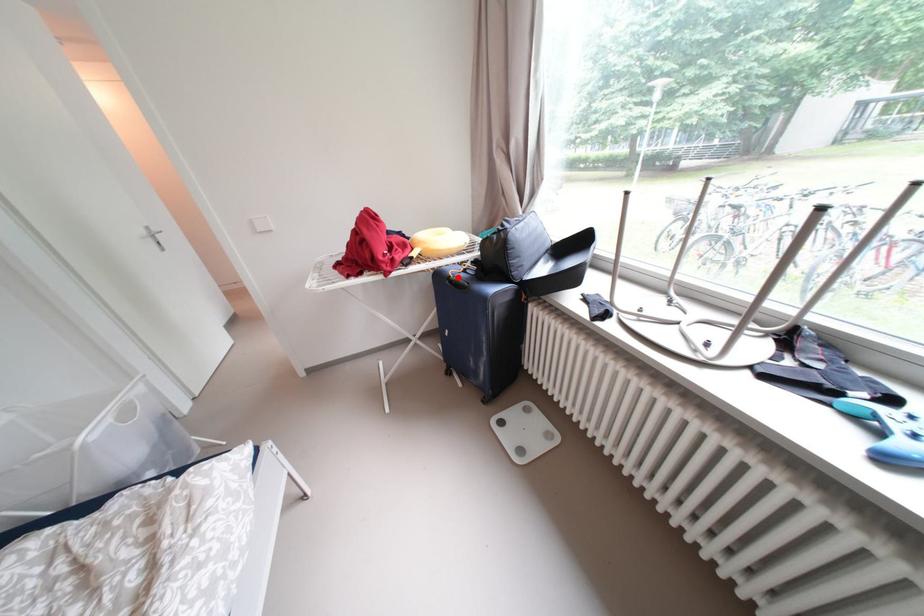
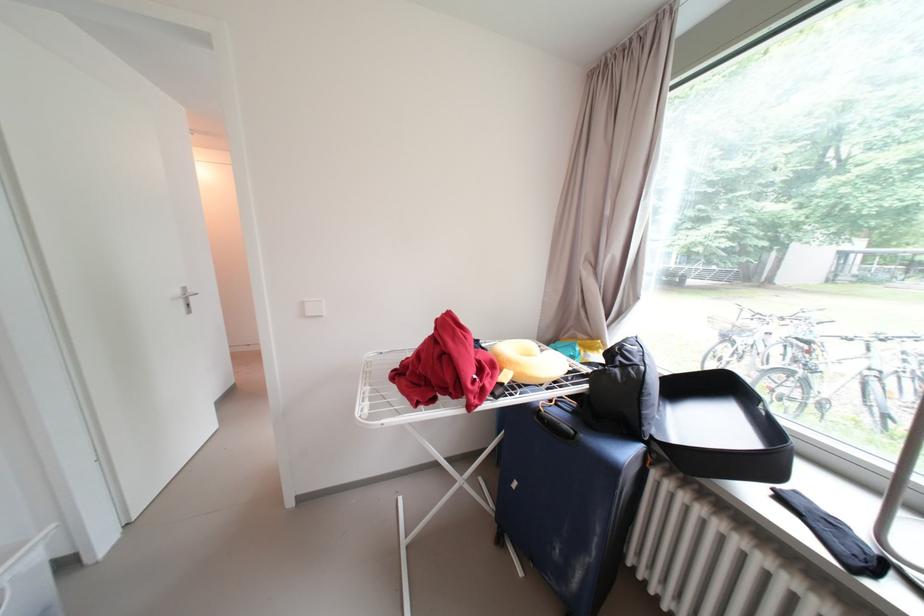
Question: I am providing you with two images of the same scene from different viewpoints. Image1 has a red point marked. In image2, the corresponding 3D location appears at what relative position? Reply with the corresponding letter.

Choices:
 (A) Closer
 (B) Farther

Answer: (B)